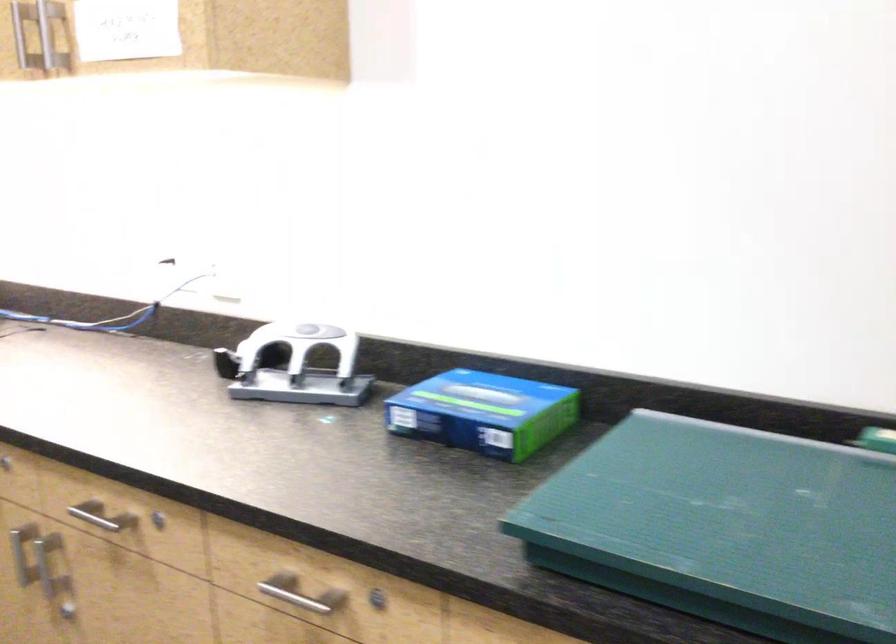
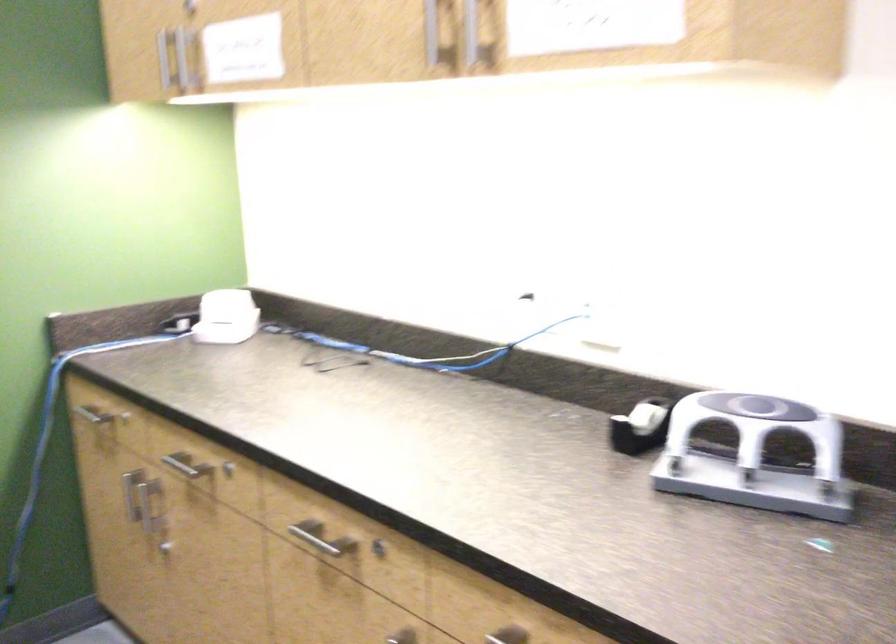
Locate, in the second image, the point that corresponds to point 309,366 in the first image.

(755, 456)